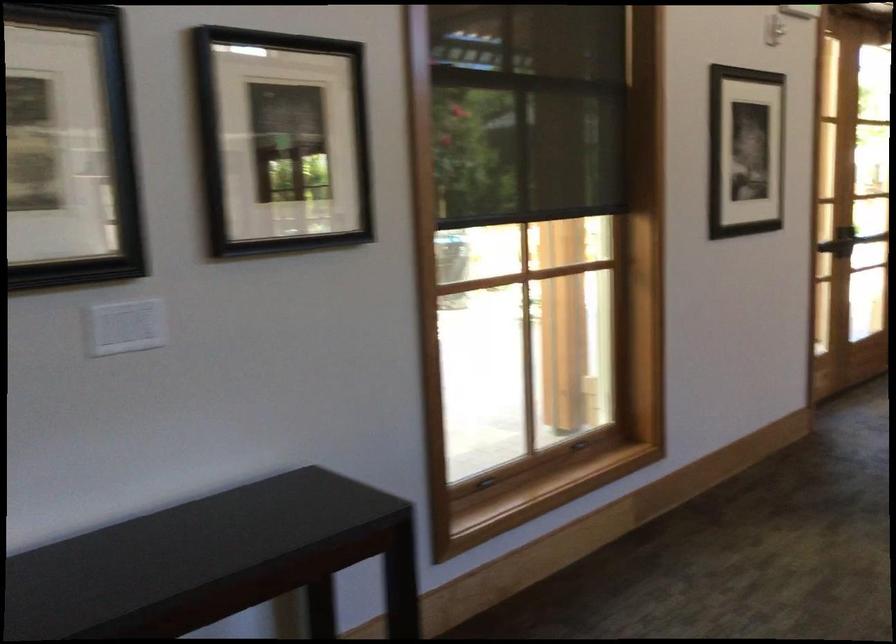
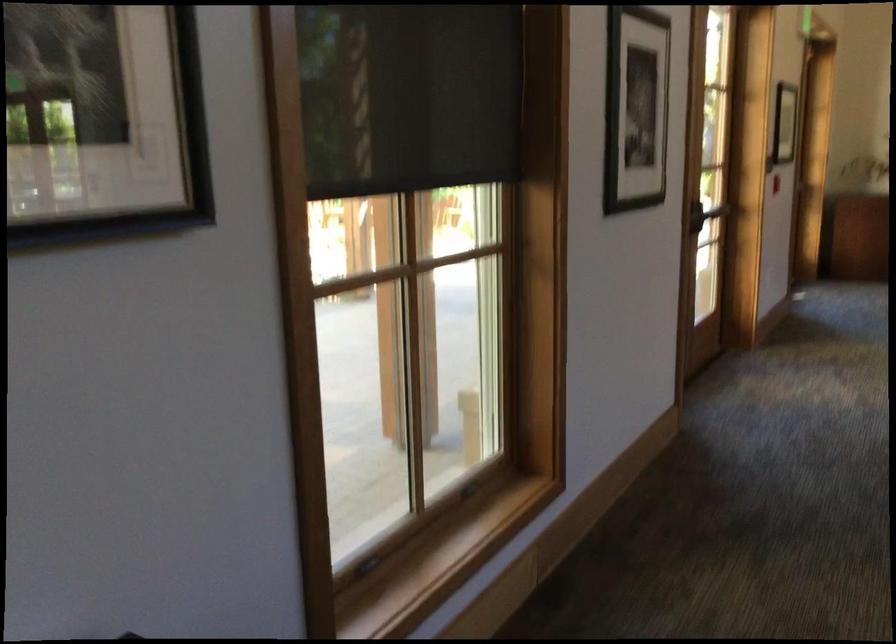
Question: What movement of the cameraman would produce the second image?

Choices:
 (A) Left
 (B) Right
 (C) Forward
 (D) Backward

Answer: (C)